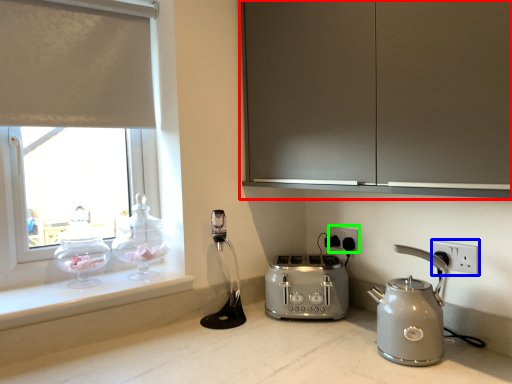
Question: Which object is the closest to the cabinetry (highlighted by a red box)? Choose among these: electric outlet (highlighted by a blue box) or electric outlet (highlighted by a green box).

Choices:
 (A) electric outlet
 (B) electric outlet

Answer: (A)